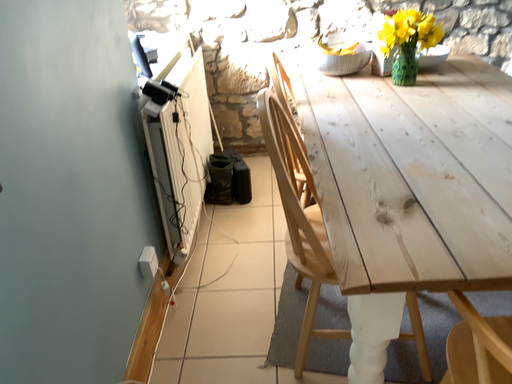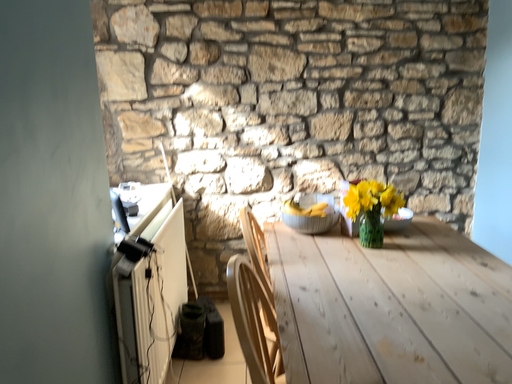
Question: How did the camera likely rotate when shooting the video?

Choices:
 (A) rotated upward
 (B) rotated downward

Answer: (A)